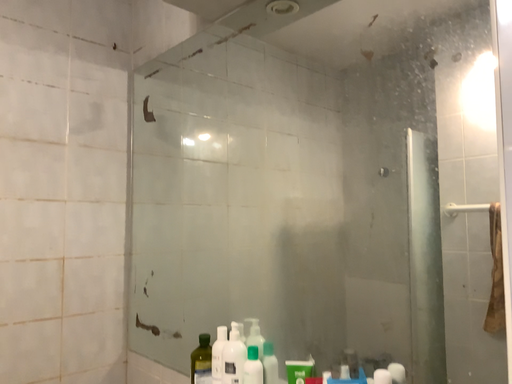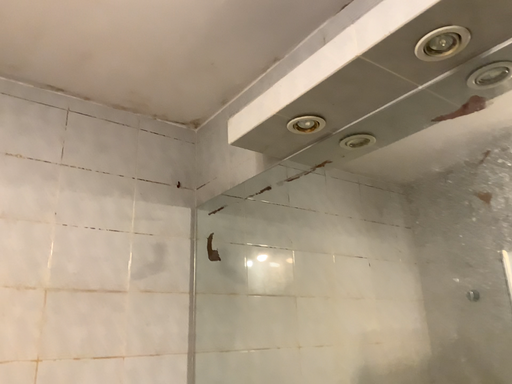
Question: Which way did the camera rotate in the video?

Choices:
 (A) rotated upward
 (B) rotated downward

Answer: (A)